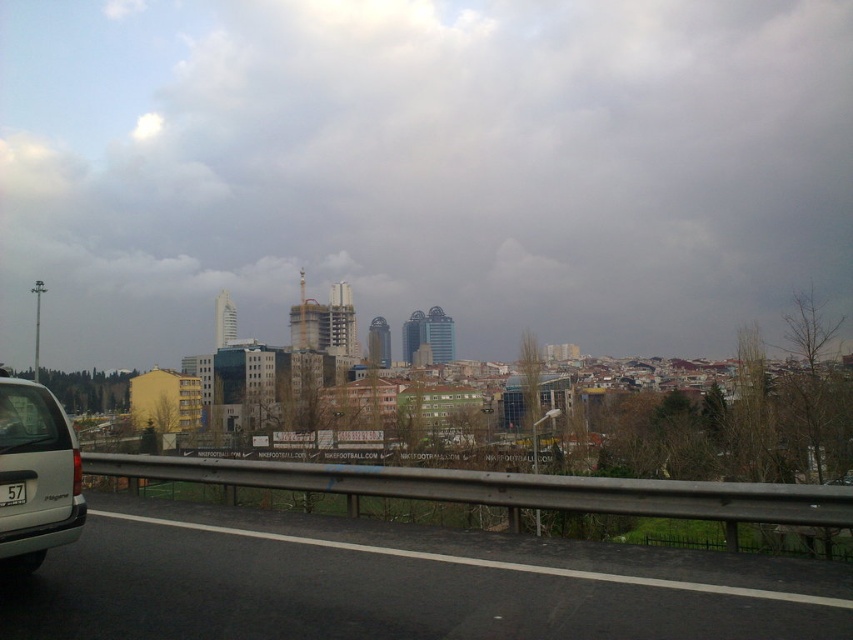
Who is positioned more to the left, silver metallic van at lower left or black plastic license plate at lower left?

silver metallic van at lower left is more to the left.

Who is more distant from viewer, (48, 476) or (3, 493)?

Positioned behind is point (48, 476).

You are a GUI agent. You are given a task and a screenshot of the screen. Output one action in this format:
    pyautogui.click(x=<x>, y=<y>)
    Task: Click on the silver metallic van at lower left
    
    Given the screenshot: What is the action you would take?
    pyautogui.click(x=36, y=474)

Looking at this image, who is more forward, (782,612) or (73,456)?

Point (782,612) is in front.

Identify the location of black asphalt highway at lower left. (399, 584).

Between black asphalt highway at lower left and black plastic license plate at lower left, which one appears on the right side from the viewer's perspective?

black asphalt highway at lower left

Does black asphalt highway at lower left have a lesser width compared to black plastic license plate at lower left?

Incorrect, black asphalt highway at lower left's width is not less than black plastic license plate at lower left's.

Which is behind, point (834, 568) or point (24, 500)?

Point (834, 568)

Locate an element on the screen. Image resolution: width=853 pixels, height=640 pixels. black asphalt highway at lower left is located at coordinates (399, 584).